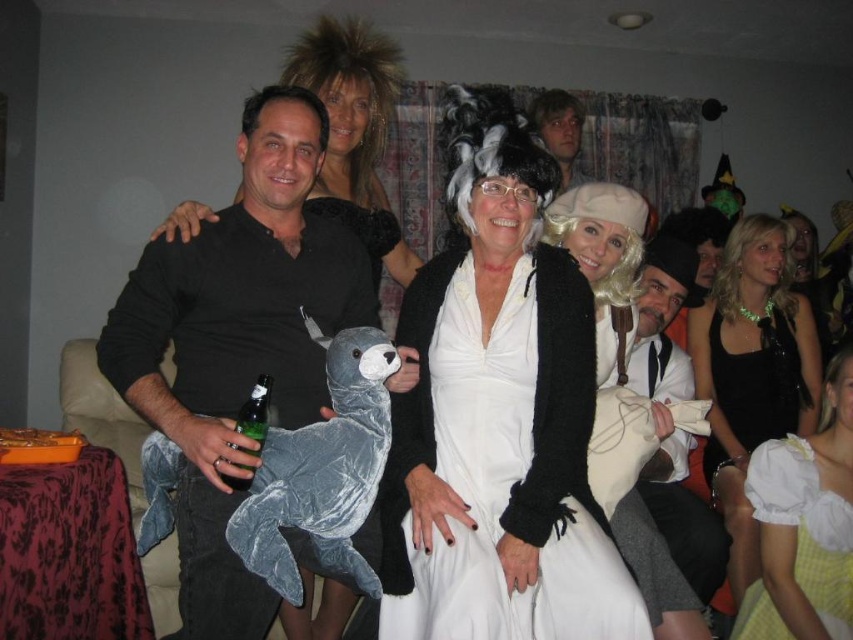
In the scene shown: You are a photographer trying to capture a clear shot of the white matte dress at center and the white matte wig at upper center. Which object should you focus on first if you want to ensure both are in focus, considering their sizes?

The white matte dress at center is smaller than the white matte wig at upper center. To ensure both are in focus, you should focus on the smaller object first, which is the white matte dress at center.